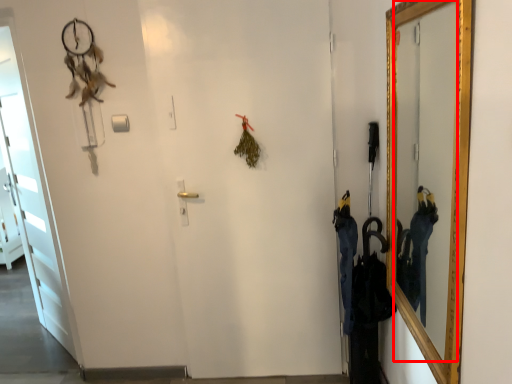
Question: Considering the relative positions of mirror (annotated by the red box) and door in the image provided, where is mirror (annotated by the red box) located with respect to the staircase?

Choices:
 (A) left
 (B) right

Answer: (B)